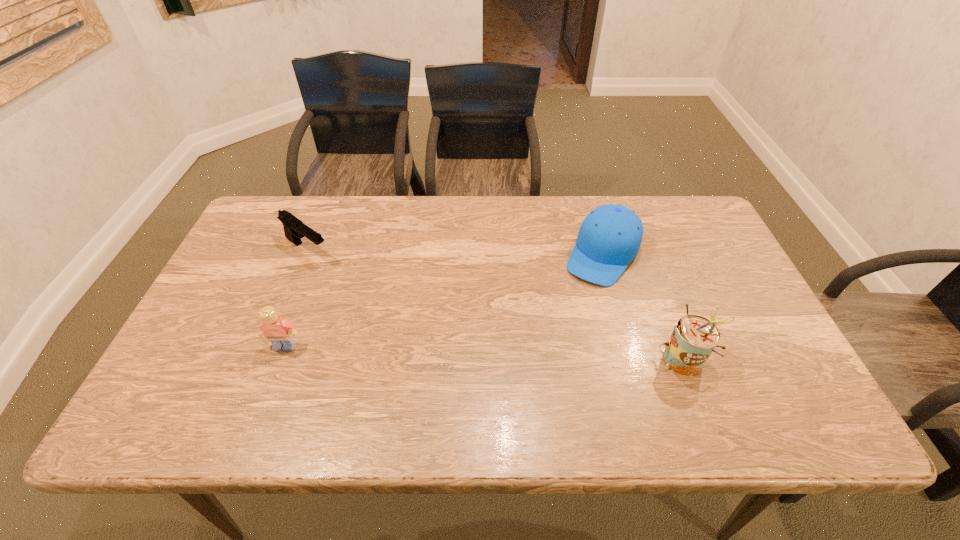
This screenshot has height=540, width=960. What are the coordinates of `vacant space in between the Lego and the pistol` in the screenshot? It's located at (296, 298).

This screenshot has width=960, height=540. I want to click on free point between the pistol and the cap, so click(x=455, y=252).

Identify which object is the nearest to the cap. Please provide its 2D coordinates. Your answer should be formatted as a tuple, i.e. [(x, y)], where the tuple contains the x and y coordinates of a point satisfying the conditions above.

[(694, 338)]

Locate which object ranks in proximity to the cap. Please provide its 2D coordinates. Your answer should be formatted as a tuple, i.e. [(x, y)], where the tuple contains the x and y coordinates of a point satisfying the conditions above.

[(694, 338)]

Find the location of a particular element. The image size is (960, 540). vacant area in the image that satisfies the following two spatial constraints: 1. on the front-facing side of the Lego; 2. on the left side of the tallest object is located at coordinates (280, 357).

Identify the location of free spot that satisfies the following two spatial constraints: 1. on the front-facing side of the Lego; 2. on the right side of the tallest object. This screenshot has height=540, width=960. (280, 357).

Where is `free region that satisfies the following two spatial constraints: 1. on the front-facing side of the can; 2. on the right side of the Lego`? free region that satisfies the following two spatial constraints: 1. on the front-facing side of the can; 2. on the right side of the Lego is located at coordinates (280, 357).

Locate an element on the screen. Image resolution: width=960 pixels, height=540 pixels. free point that satisfies the following two spatial constraints: 1. on the front-facing side of the tallest object; 2. on the right side of the Lego is located at coordinates (280, 357).

Locate an element on the screen. The width and height of the screenshot is (960, 540). vacant point that satisfies the following two spatial constraints: 1. on the front-facing side of the Lego; 2. on the right side of the tallest object is located at coordinates (280, 357).

This screenshot has height=540, width=960. In order to click on blank area in the image that satisfies the following two spatial constraints: 1. on the front-facing side of the Lego; 2. on the left side of the tallest object in this screenshot , I will do `click(280, 357)`.